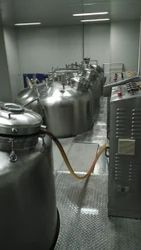
I want to click on ceiling of the laboratory, so click(26, 11), click(52, 11), click(62, 23), click(116, 13), click(126, 5).